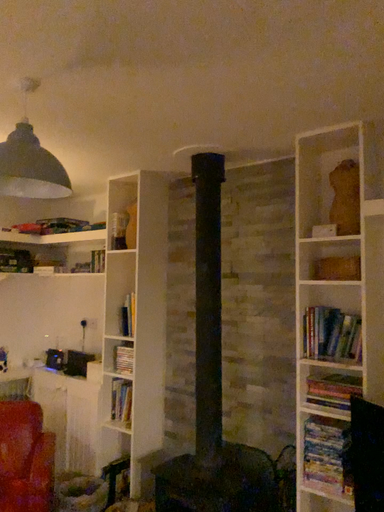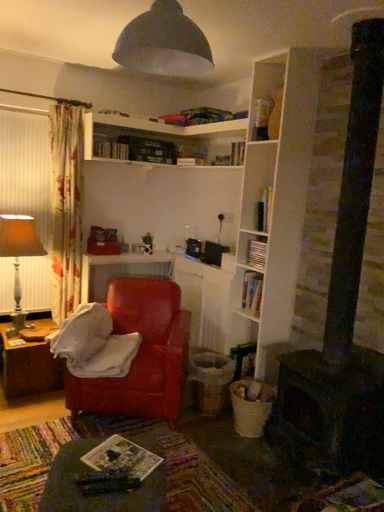
Question: How did the camera likely rotate when shooting the video?

Choices:
 (A) rotated left
 (B) rotated right

Answer: (A)